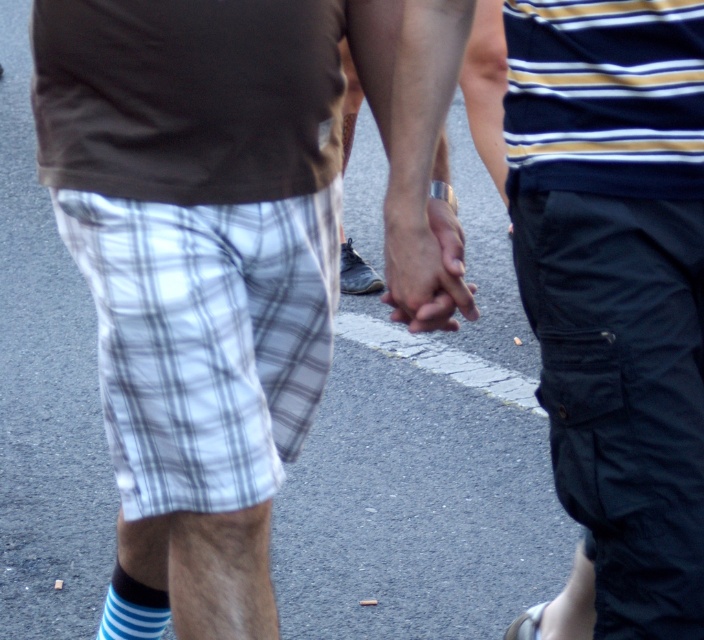
Question: Which object appears closest to the camera in this image?

Choices:
 (A) white plaid shorts at lower left
 (B) dark blue cargo pants at right
 (C) matte skin at center
 (D) blue and white checkered shorts at center

Answer: (D)

Question: Which of the following is the farthest from the observer?

Choices:
 (A) blue and white checkered shorts at center
 (B) matte skin at center

Answer: (B)

Question: Based on their relative distances, which object is farther from the blue and white checkered shorts at center?

Choices:
 (A) matte skin at center
 (B) white plaid shorts at lower left

Answer: (B)

Question: Can you confirm if dark blue cargo pants at right is positioned to the right of matte skin at center?

Choices:
 (A) no
 (B) yes

Answer: (B)

Question: Considering the relative positions of dark blue cargo pants at right and white plaid shorts at lower left in the image provided, where is dark blue cargo pants at right located with respect to white plaid shorts at lower left?

Choices:
 (A) above
 (B) below

Answer: (A)

Question: Is white plaid shorts at lower left closer to camera compared to striped cotton sock at lower left?

Choices:
 (A) yes
 (B) no

Answer: (A)